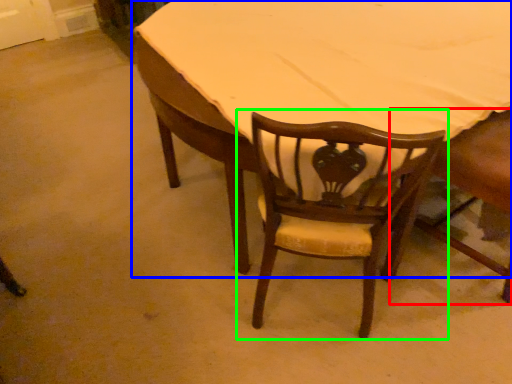
Question: Based on their relative distances, which object is farther from chair (highlighted by a red box)? Choose from table (highlighted by a blue box) and chair (highlighted by a green box).

Choices:
 (A) table
 (B) chair

Answer: (A)